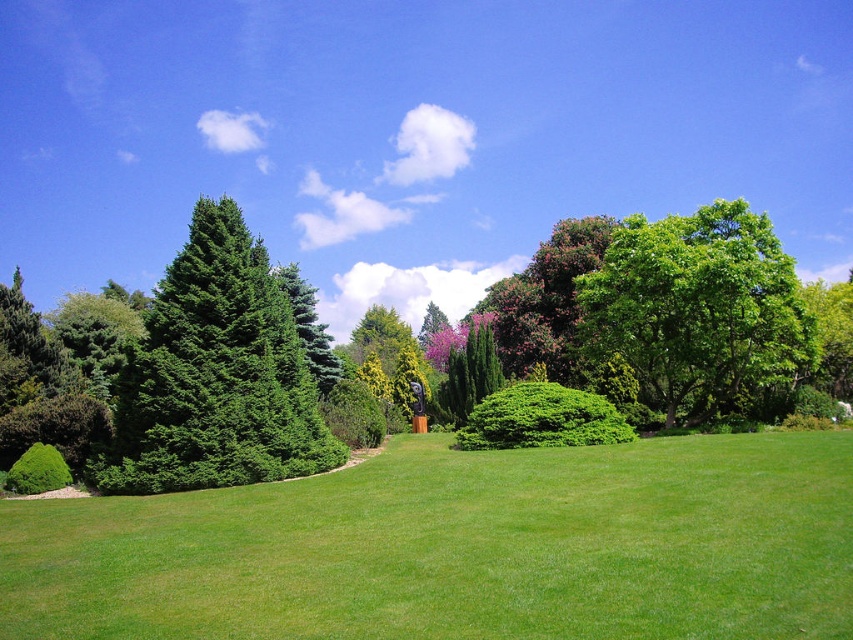
You are standing in the garden and want to know how far you are from the point marked at coordinates point [527,518]. Can you determine the distance?

The distance between you and the point [527,518] is 10.48 meters.

In the scene shown: You are a gardener who needs to place a 6.5 feet wide decorative stone path between the green glossy evergreen tree at left and the green leafy bush at lower left. Can the path fit between them without overlapping either plant?

The distance between the green glossy evergreen tree at left and the green leafy bush at lower left is 7.04 feet. Since the path is 6.5 feet wide, it can fit between them as the available space is wider than the path.

You are planning to place a 3 meter wide garden bench in this garden. Based on the scene, which object between the green grass at center and the green glossy evergreen tree at left would be suitable to place it without overlapping? Explain your choice.

The green grass at center has a larger width than the green glossy evergreen tree at left. Therefore, placing the 3 meter wide garden bench on the green grass at center would be suitable as it provides enough space without overlapping the tree.